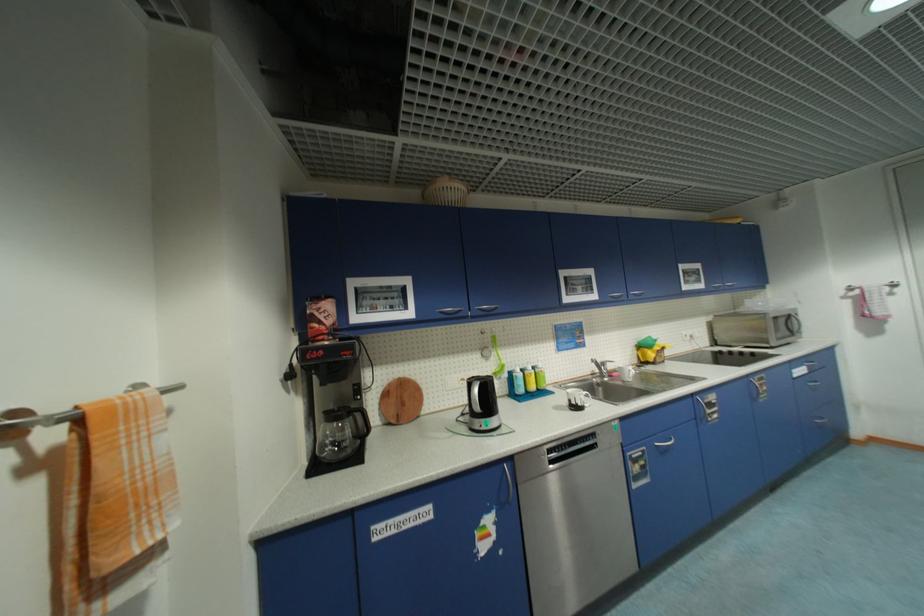
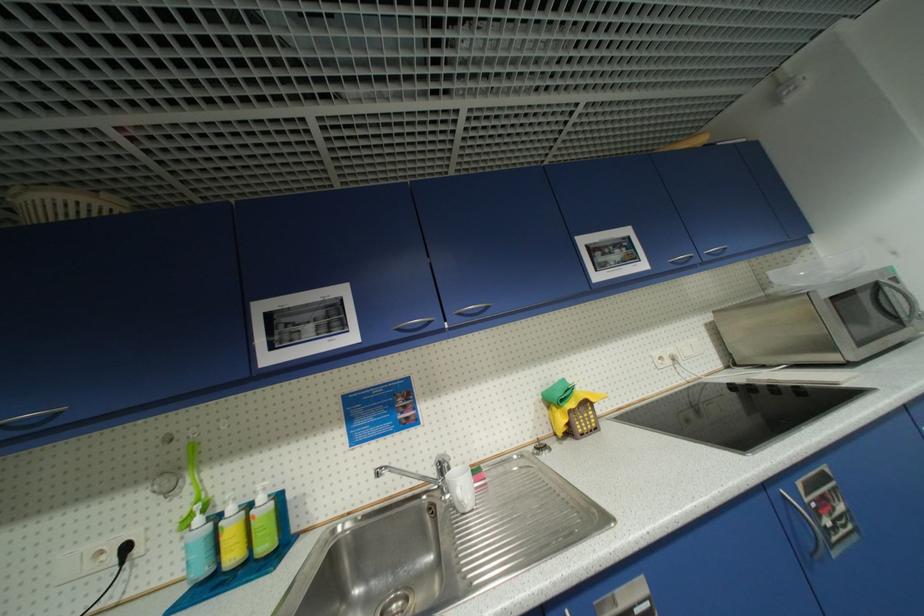
Which direction would the cameraman need to move to produce the second image?

The cameraman walked toward right, forward.